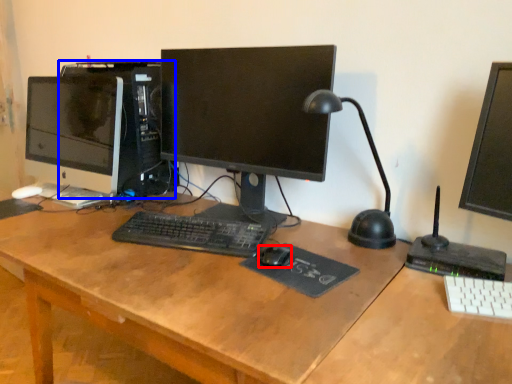
Question: Which object appears farthest to the camera in this image, mouse (highlighted by a red box) or computer tower (highlighted by a blue box)?

Choices:
 (A) mouse
 (B) computer tower

Answer: (B)